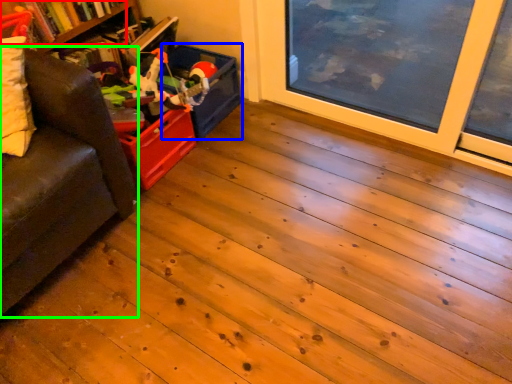
Question: Considering the real-world distances, which object is farthest from book (highlighted by a red box)? storage box (highlighted by a blue box) or studio couch (highlighted by a green box)?

Choices:
 (A) storage box
 (B) studio couch

Answer: (B)